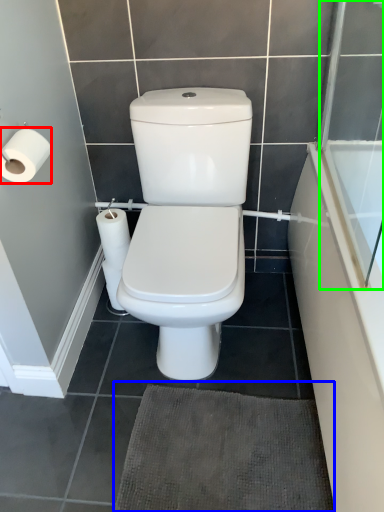
Question: Estimate the real-world distances between objects in this image. Which object is closer to toilet paper (highlighted by a red box), bath mat (highlighted by a blue box) or screen door (highlighted by a green box)?

Choices:
 (A) bath mat
 (B) screen door

Answer: (A)